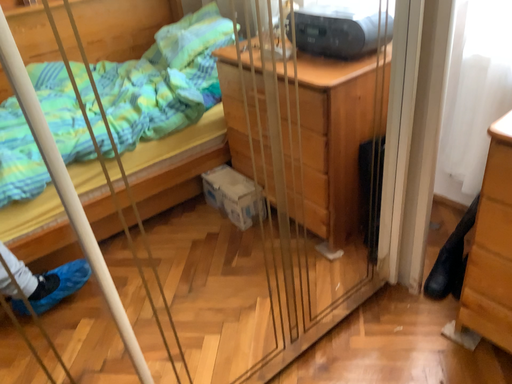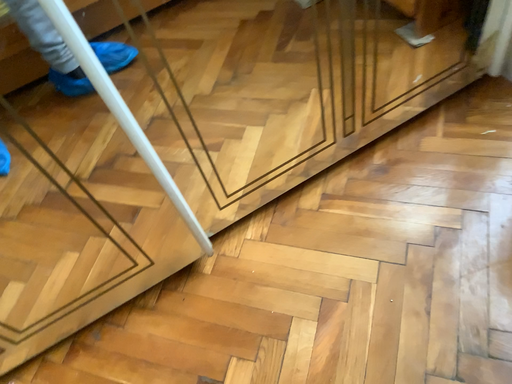
Question: Which way did the camera rotate in the video?

Choices:
 (A) rotated left
 (B) rotated right

Answer: (A)